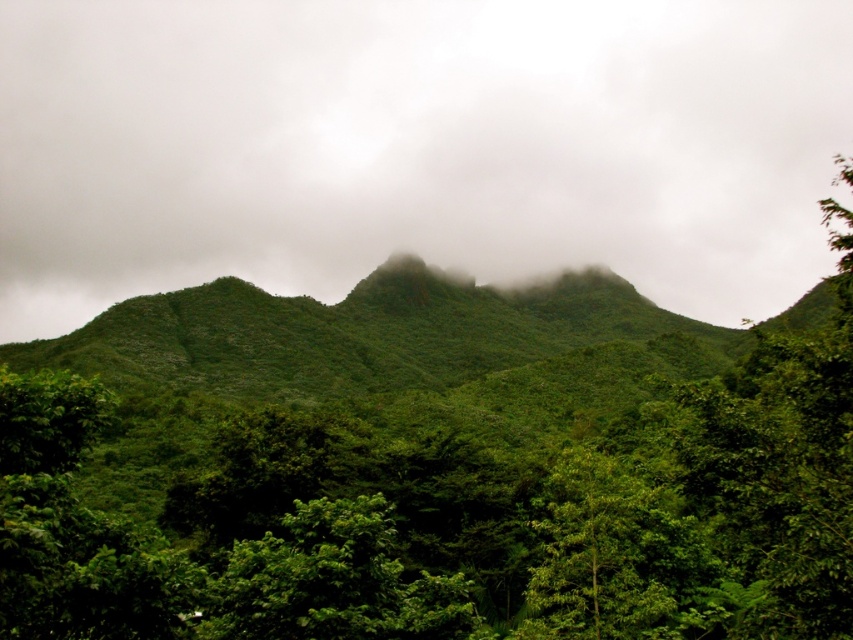
From the picture: You are a hiker standing at the base of the green leafy tree at lower center. Looking up, can you see the foggy misty mountain at upper center above the tree?

Yes, the foggy misty mountain at upper center is positioned above the green leafy tree at lower center, so you can see it from your vantage point.

You are a hiker planning to hike from the green leafy tree at lower center to the foggy misty mountain at upper center. The trail is straight and clear. Your GPS says the distance is 1217.53 feet. If you walk at a steady pace of 3 feet per second, how many minutes will it take you to reach the mountain?

The distance between the foggy misty mountain at upper center and the green leafy tree at lower center is 1217.53 feet. Walking at 3 feet per second, it would take 1217.53 divided by 3 equals approximately 405.84 seconds. Converting seconds to minutes by dividing by 60 gives roughly 6.76 minutes. So, it will take about 6.8 minutes to reach the mountain.

Consider the image. You are a hiker planning to take a photo of the foggy misty mountain at upper center and the green leafy tree at lower center. To ensure both are in focus, you need to know which one is taller. Which object is taller?

The foggy misty mountain at upper center is taller than the green leafy tree at lower center according to the description.